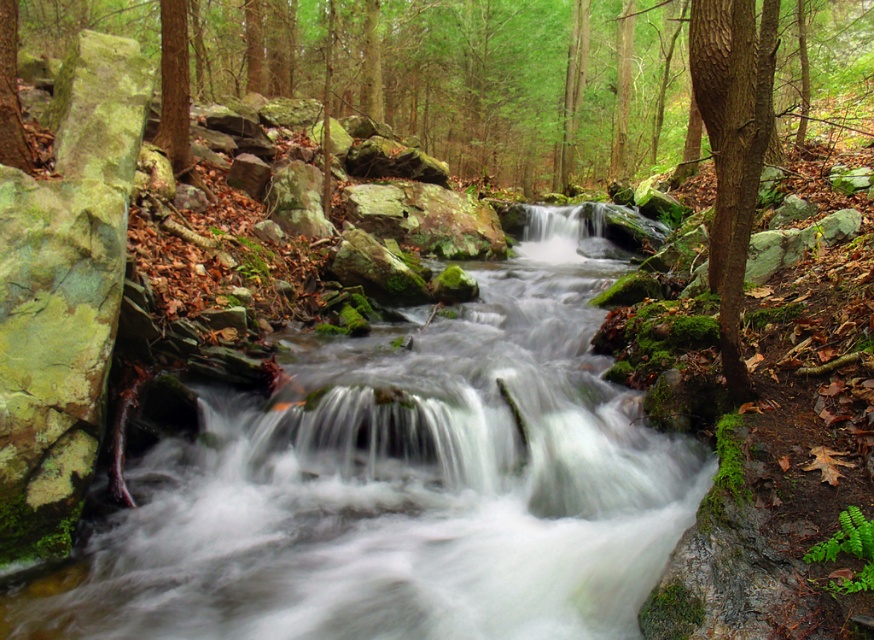
Does clear water stream at center have a greater width compared to smooth bark tree at right?

No.

Is point (247, 499) positioned after point (773, 17)?

Yes, it is behind point (773, 17).

Measure the distance between clear water stream at center and camera.

clear water stream at center and camera are 4.38 meters apart.

Find the location of `clear water stream at center`. clear water stream at center is located at coordinates (406, 486).